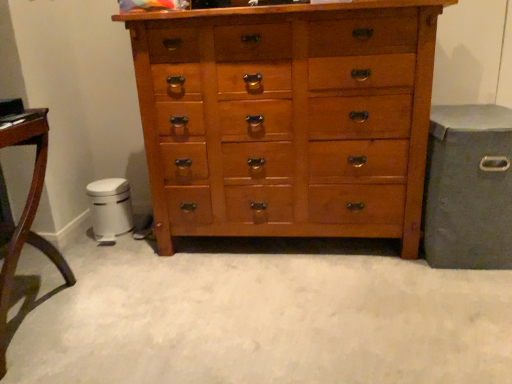
Question: Relative to matte gray storage bin at right, is brushed metal trash can at lower left in front or behind?

Choices:
 (A) behind
 (B) front

Answer: (A)

Question: From the image's perspective, is brushed metal trash can at lower left positioned above or below matte gray storage bin at right?

Choices:
 (A) above
 (B) below

Answer: (B)

Question: Based on their relative distances, which object is farther from the brushed metal trash can at lower left?

Choices:
 (A) mahogany wood table at left
 (B) matte gray storage bin at right
 (C) wooden chest of drawers at center

Answer: (B)

Question: Which object is positioned closest to the mahogany wood table at left?

Choices:
 (A) brushed metal trash can at lower left
 (B) wooden chest of drawers at center
 (C) matte gray storage bin at right

Answer: (A)